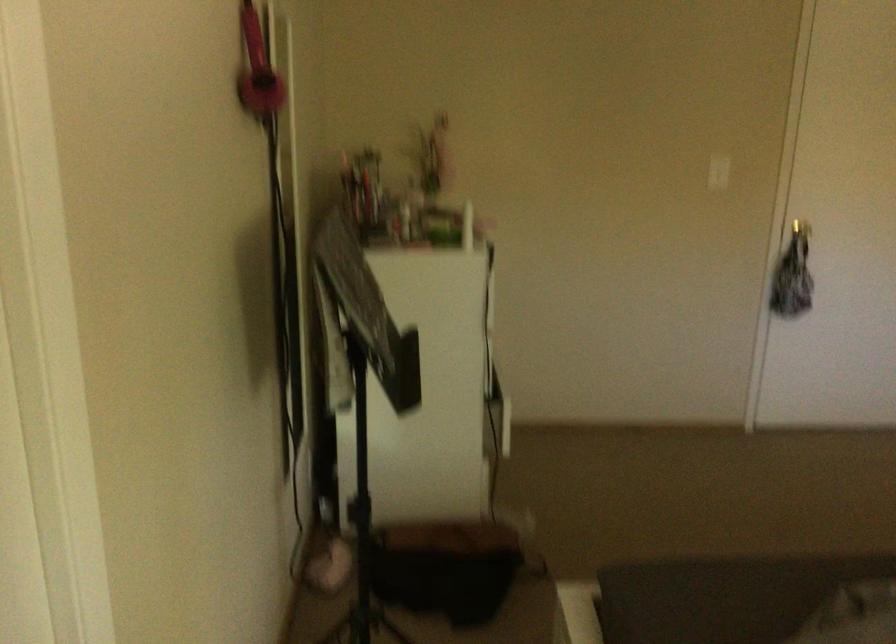
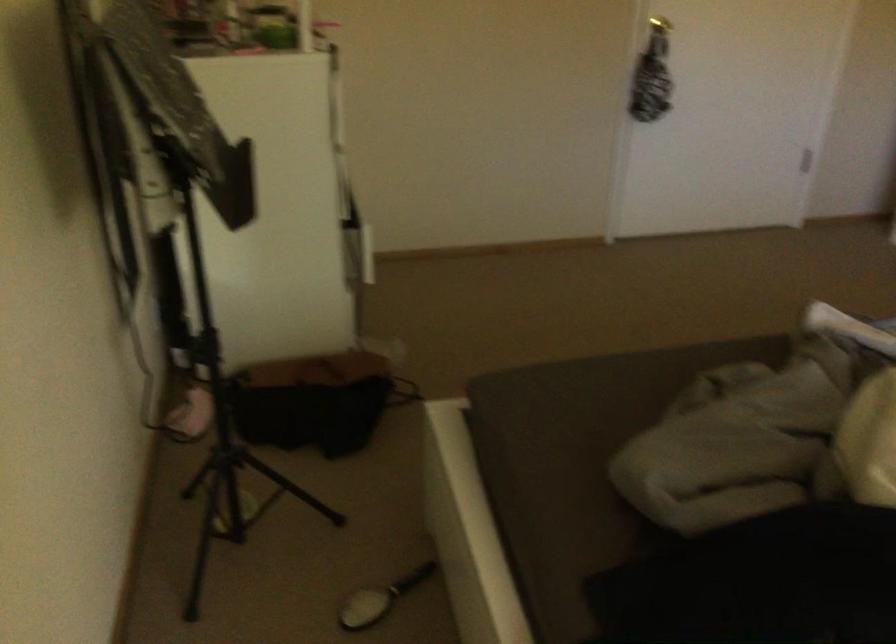
Find the pixel in the second image that matches point (814, 220) in the first image.

(659, 24)